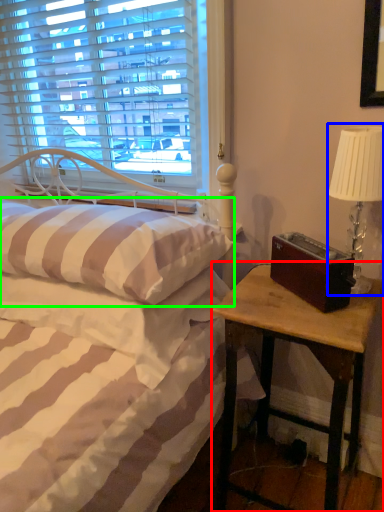
Question: Which is nearer to the nightstand (highlighted by a red box)? table lamp (highlighted by a blue box) or pillow (highlighted by a green box).

Choices:
 (A) table lamp
 (B) pillow

Answer: (A)